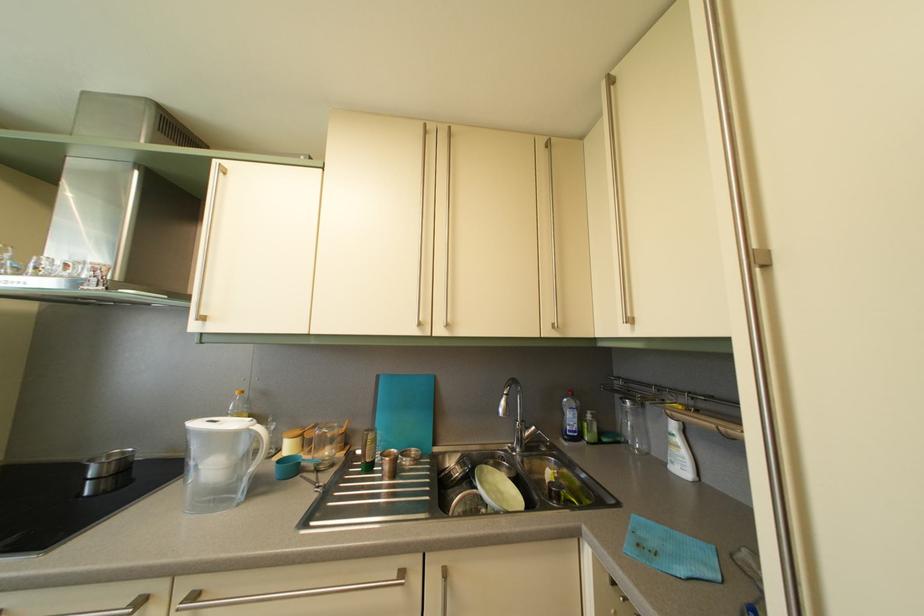
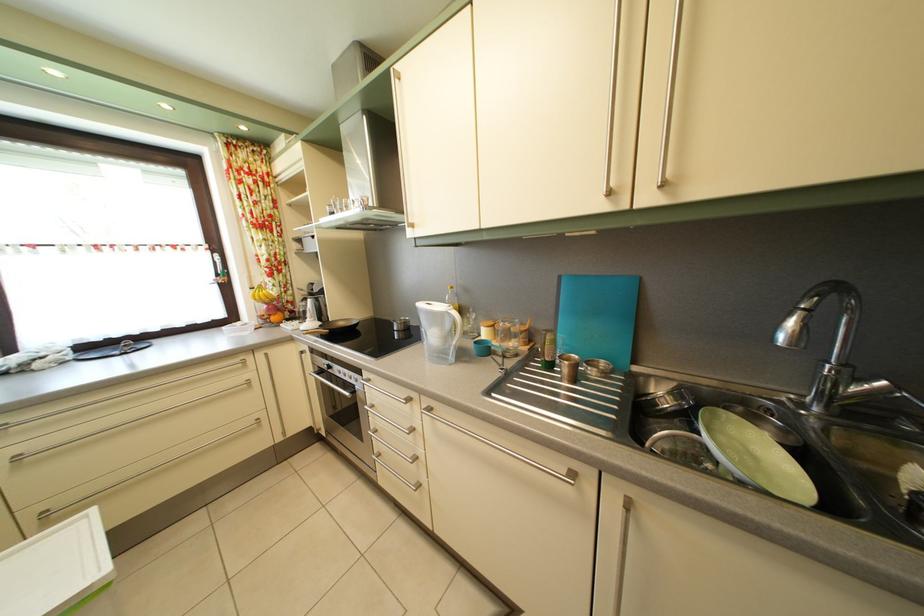
Find the pixel in the second image that matches pixel 509 500 in the first image.

(763, 466)